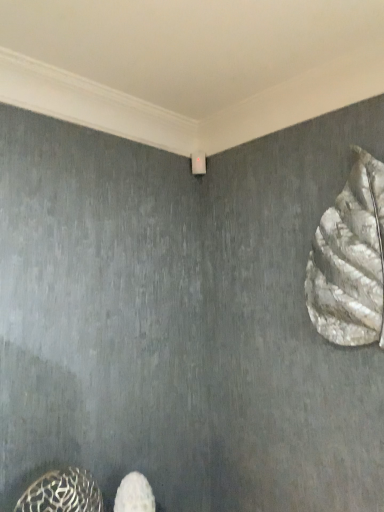
What do you see at coordinates (62, 493) in the screenshot?
I see `metallic patterned shoe at lower left, the 2th animal from the right` at bounding box center [62, 493].

Where is `metallic patterned shoe at lower left, the 1th animal when ordered from left to right`? This screenshot has height=512, width=384. metallic patterned shoe at lower left, the 1th animal when ordered from left to right is located at coordinates (62, 493).

From a real-world perspective, is metallic patterned shoe at lower left, which is counted as the second animal, starting from the top, on top of white fabric shoe at lower center?

Yes, from a real-world perspective, metallic patterned shoe at lower left, which is counted as the second animal, starting from the top, is above white fabric shoe at lower center.

Is metallic patterned shoe at lower left, marked as the first animal in a bottom-to-top arrangement, wider or thinner than white fabric shoe at lower center?

In the image, metallic patterned shoe at lower left, marked as the first animal in a bottom-to-top arrangement, appears to be more narrow than white fabric shoe at lower center.

Is point (308, 283) in front of point (124, 496)?

No, (308, 283) is behind (124, 496).

Is white textured sculpture at right, which ranks as the 1th animal in top-to-bottom order, aimed at white fabric shoe at lower center?

No, white textured sculpture at right, which ranks as the 1th animal in top-to-bottom order, does not turn towards white fabric shoe at lower center.

From a real-world perspective, relative to white fabric shoe at lower center, is white textured sculpture at right, the 1th animal viewed from the right, vertically above or below?

From a real-world perspective, white textured sculpture at right, the 1th animal viewed from the right, is physically above white fabric shoe at lower center.

From the image's perspective, is white fabric shoe at lower center above or below metallic patterned shoe at lower left, the 2th animal from the right?

From the image's perspective, white fabric shoe at lower center appears below metallic patterned shoe at lower left, the 2th animal from the right.

Between white fabric shoe at lower center and metallic patterned shoe at lower left, which is counted as the second animal, starting from the top, which one has smaller size?

white fabric shoe at lower center.

Would you say white fabric shoe at lower center is outside metallic patterned shoe at lower left, which is counted as the second animal, starting from the top?

white fabric shoe at lower center is positioned outside metallic patterned shoe at lower left, which is counted as the second animal, starting from the top.

Is white fabric shoe at lower center in front of or behind metallic patterned shoe at lower left, marked as the first animal in a bottom-to-top arrangement, in the image?

white fabric shoe at lower center is behind metallic patterned shoe at lower left, marked as the first animal in a bottom-to-top arrangement.

Can you tell me how much white fabric shoe at lower center and white textured sculpture at right, placed as the 2th animal when sorted from left to right, differ in facing direction?

90.1 degrees.

Are white fabric shoe at lower center and white textured sculpture at right, which is the second animal in bottom-to-top order, far apart?

No, white fabric shoe at lower center is not far from white textured sculpture at right, which is the second animal in bottom-to-top order.

Considering the points (141, 501) and (371, 257), which point is in front, point (141, 501) or point (371, 257)?

The point (371, 257) is closer.

Does metallic patterned shoe at lower left, which is counted as the second animal, starting from the top, have a lesser width compared to white textured sculpture at right, which ranks as the 1th animal in top-to-bottom order?

No.

Considering the relative positions of metallic patterned shoe at lower left, the 1th animal when ordered from left to right, and white textured sculpture at right, the 1th animal viewed from the right, in the image provided, is metallic patterned shoe at lower left, the 1th animal when ordered from left to right, to the right of white textured sculpture at right, the 1th animal viewed from the right, from the viewer's perspective?

No, metallic patterned shoe at lower left, the 1th animal when ordered from left to right, is not to the right of white textured sculpture at right, the 1th animal viewed from the right.

Which of these two, metallic patterned shoe at lower left, which is counted as the second animal, starting from the top, or white textured sculpture at right, the 1th animal viewed from the right, is smaller?

With smaller size is metallic patterned shoe at lower left, which is counted as the second animal, starting from the top.

Measure the distance from metallic patterned shoe at lower left, which is counted as the second animal, starting from the top, to white textured sculpture at right, which ranks as the 1th animal in top-to-bottom order.

metallic patterned shoe at lower left, which is counted as the second animal, starting from the top, is 1.07 meters away from white textured sculpture at right, which ranks as the 1th animal in top-to-bottom order.

Is white textured sculpture at right, which is the second animal in bottom-to-top order, positioned far away from metallic patterned shoe at lower left, marked as the first animal in a bottom-to-top arrangement?

white textured sculpture at right, which is the second animal in bottom-to-top order, is far away from metallic patterned shoe at lower left, marked as the first animal in a bottom-to-top arrangement.

Does white textured sculpture at right, the 1th animal viewed from the right, have a lesser width compared to metallic patterned shoe at lower left, the 2th animal from the right?

Correct, the width of white textured sculpture at right, the 1th animal viewed from the right, is less than that of metallic patterned shoe at lower left, the 2th animal from the right.

Is white textured sculpture at right, which is the second animal in bottom-to-top order, bigger than metallic patterned shoe at lower left, which is counted as the second animal, starting from the top?

Indeed, white textured sculpture at right, which is the second animal in bottom-to-top order, has a larger size compared to metallic patterned shoe at lower left, which is counted as the second animal, starting from the top.

Does white textured sculpture at right, placed as the 2th animal when sorted from left to right, have a lesser height compared to metallic patterned shoe at lower left, which is counted as the second animal, starting from the top?

Incorrect, the height of white textured sculpture at right, placed as the 2th animal when sorted from left to right, does not fall short of that of metallic patterned shoe at lower left, which is counted as the second animal, starting from the top.

Where is `footwear that appears on the right of metallic patterned shoe at lower left, the 2th animal from the right`? footwear that appears on the right of metallic patterned shoe at lower left, the 2th animal from the right is located at coordinates pyautogui.click(x=134, y=494).

I want to click on footwear below the white textured sculpture at right, which is the second animal in bottom-to-top order (from a real-world perspective), so click(134, 494).

Which object lies nearer to the anchor point white textured sculpture at right, which ranks as the 1th animal in top-to-bottom order, white fabric shoe at lower center or metallic patterned shoe at lower left, which is counted as the second animal, starting from the top?

Based on the image, white fabric shoe at lower center appears to be nearer to white textured sculpture at right, which ranks as the 1th animal in top-to-bottom order.

Based on their spatial positions, is metallic patterned shoe at lower left, marked as the first animal in a bottom-to-top arrangement, or white fabric shoe at lower center further from white textured sculpture at right, placed as the 2th animal when sorted from left to right?

metallic patterned shoe at lower left, marked as the first animal in a bottom-to-top arrangement, is further to white textured sculpture at right, placed as the 2th animal when sorted from left to right.

From the image, which object appears to be farther from white fabric shoe at lower center, white textured sculpture at right, which is the second animal in bottom-to-top order, or metallic patterned shoe at lower left, the 1th animal when ordered from left to right?

white textured sculpture at right, which is the second animal in bottom-to-top order, is further to white fabric shoe at lower center.

Looking at the image, which one is located closer to white fabric shoe at lower center, metallic patterned shoe at lower left, marked as the first animal in a bottom-to-top arrangement, or white textured sculpture at right, placed as the 2th animal when sorted from left to right?

metallic patterned shoe at lower left, marked as the first animal in a bottom-to-top arrangement, lies closer to white fabric shoe at lower center than the other object.

Which object lies further to the anchor point metallic patterned shoe at lower left, the 1th animal when ordered from left to right, white textured sculpture at right, placed as the 2th animal when sorted from left to right, or white fabric shoe at lower center?

white textured sculpture at right, placed as the 2th animal when sorted from left to right, is positioned further to the anchor metallic patterned shoe at lower left, the 1th animal when ordered from left to right.

From the image, which object appears to be nearer to metallic patterned shoe at lower left, marked as the first animal in a bottom-to-top arrangement, white fabric shoe at lower center or white textured sculpture at right, placed as the 2th animal when sorted from left to right?

white fabric shoe at lower center is closer to metallic patterned shoe at lower left, marked as the first animal in a bottom-to-top arrangement.

What are the coordinates of `animal between white textured sculpture at right, which ranks as the 1th animal in top-to-bottom order, and white fabric shoe at lower center from top to bottom` in the screenshot? It's located at (62, 493).